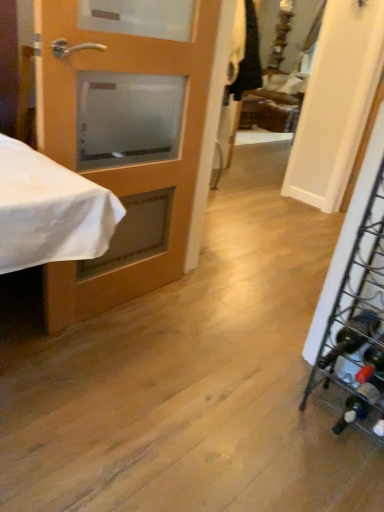
What are the coordinates of `free space on the front side of matte wood door at left` in the screenshot? It's located at (117, 369).